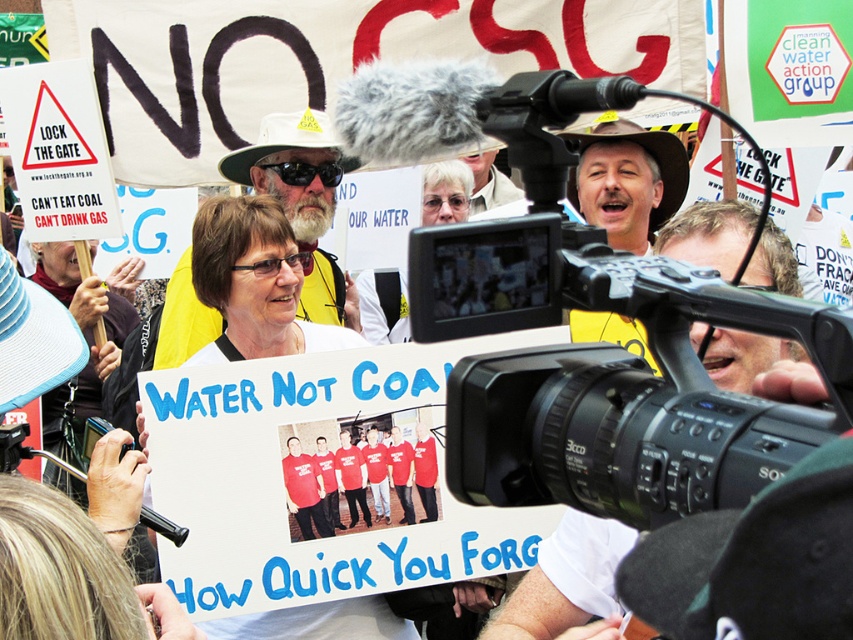
Which of these two, white paper sign at center or matte white sign at center, stands shorter?

Standing shorter between the two is matte white sign at center.

Between white paper sign at center and matte white sign at center, which one appears on the left side from the viewer's perspective?

Positioned to the left is white paper sign at center.

What do you see at coordinates (254, 282) in the screenshot?
I see `white paper sign at center` at bounding box center [254, 282].

Locate an element on the screen. white paper sign at center is located at coordinates click(254, 282).